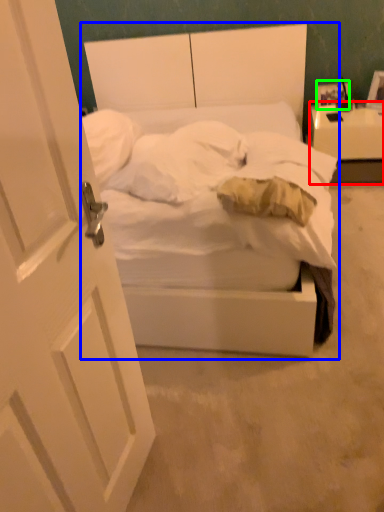
Question: Estimate the real-world distances between objects in this image. Which object is closer to nightstand (highlighted by a red box), bed (highlighted by a blue box) or picture frame (highlighted by a green box)?

Choices:
 (A) bed
 (B) picture frame

Answer: (B)